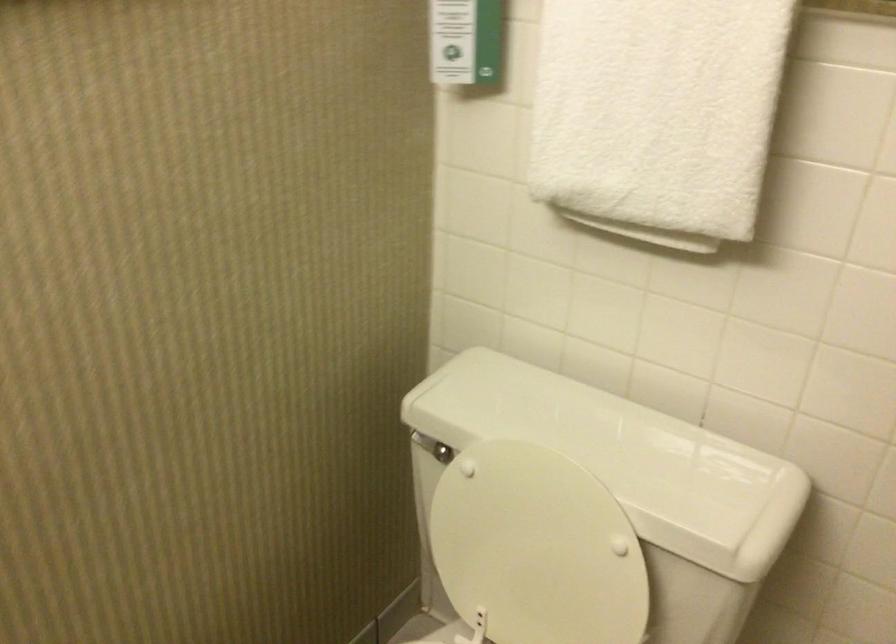
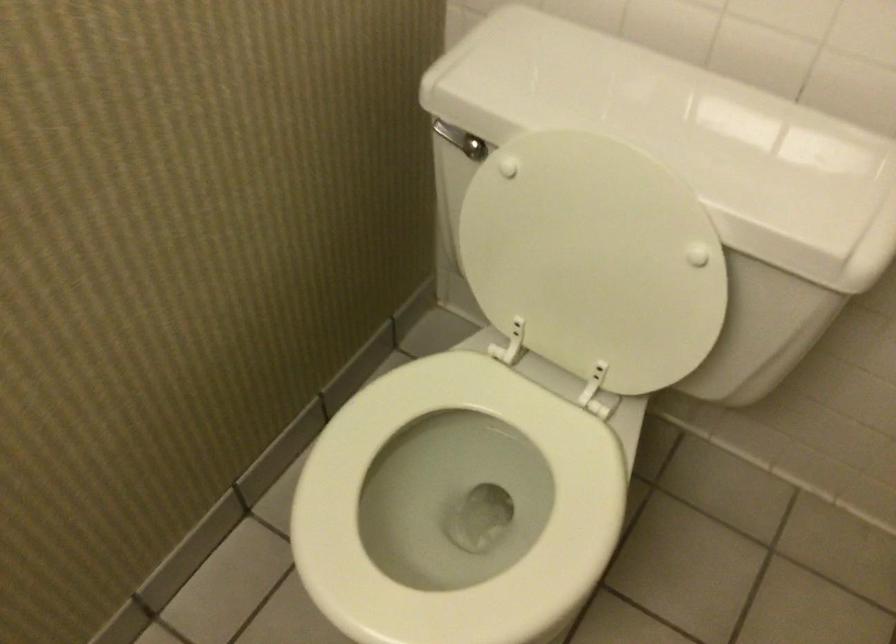
Question: The images are taken continuously from a first-person perspective. In which direction are you moving?

Choices:
 (A) Left
 (B) Right
 (C) Forward
 (D) Backward

Answer: (C)